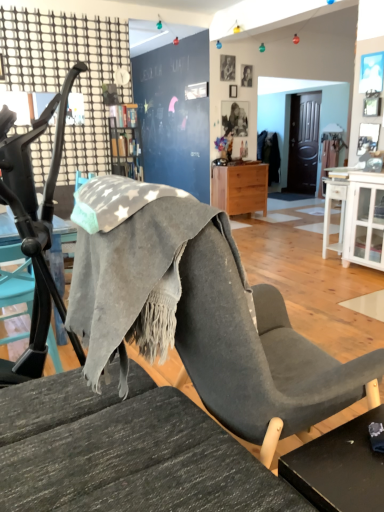
Question: In terms of height, does black matte table at lower right look taller or shorter compared to white glossy cabinet at right?

Choices:
 (A) short
 (B) tall

Answer: (A)

Question: Is black matte table at lower right inside the boundaries of white glossy cabinet at right, or outside?

Choices:
 (A) inside
 (B) outside

Answer: (B)

Question: Considering the real-world distances, which object is farthest from the wooden bookshelf at upper center?

Choices:
 (A) black matte table at lower right
 (B) gray fabric chair at left
 (C) smooth gray portrait at upper center, placed as the 2th person when sorted from back to front
 (D) smooth skin portrait at upper center, which is counted as the first person, starting from the right
 (E) white glossy cabinet at right

Answer: (A)

Question: Based on their relative distances, which object is farther from the wooden bookshelf at upper center?

Choices:
 (A) white glossy cabinet at right
 (B) light wood/texture nightstand at center
 (C) black matte table at lower right
 (D) smooth gray portrait at upper center, which is counted as the first person, starting from the left
 (E) gray fabric chair at left

Answer: (C)